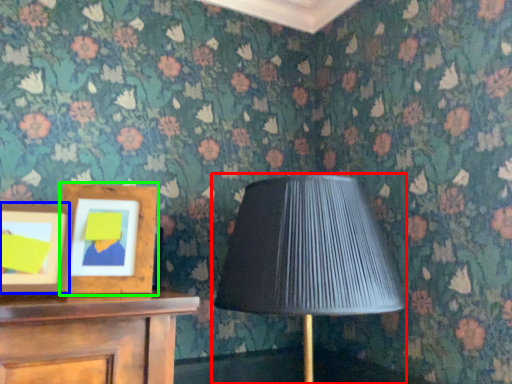
Question: Which object is the farthest from lamp (highlighted by a red box)? Choose among these: picture frame (highlighted by a blue box) or picture frame (highlighted by a green box).

Choices:
 (A) picture frame
 (B) picture frame

Answer: (A)